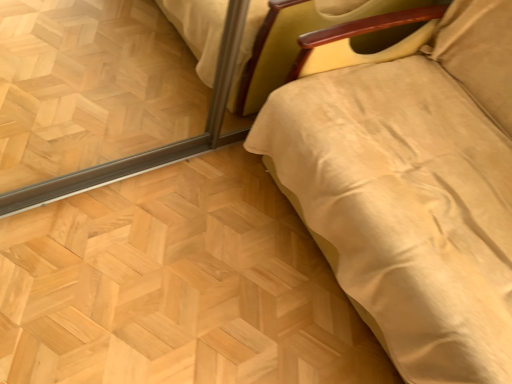
You are a GUI agent. You are given a task and a screenshot of the screen. Output one action in this format:
    pyautogui.click(x=<x>, y=<y>)
    Task: Click on the vacant area on top of natural wood floor at lower right (from a real-world perspective)
    Image resolution: width=512 pixels, height=384 pixels.
    Given the screenshot: What is the action you would take?
    pyautogui.click(x=194, y=285)